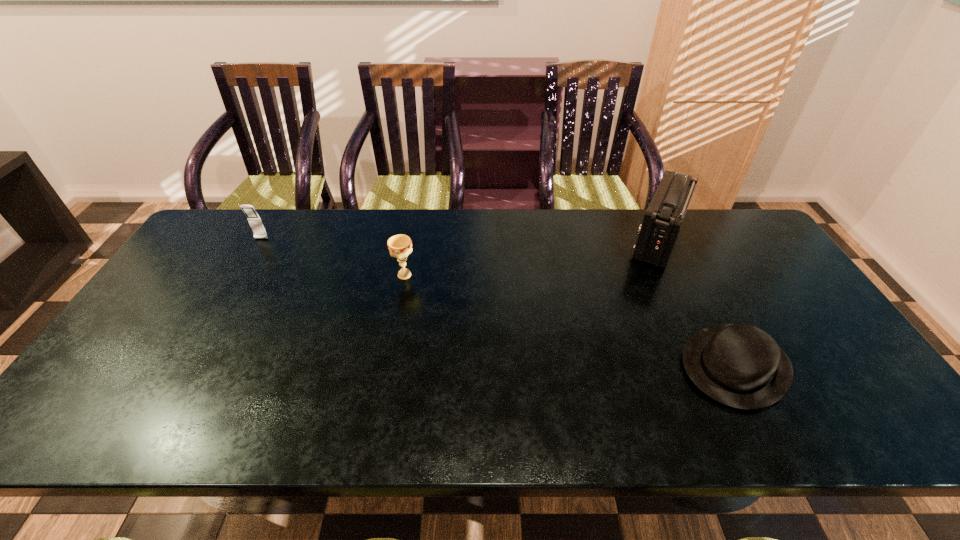
You are a GUI agent. You are given a task and a screenshot of the screen. Output one action in this format:
    pyautogui.click(x=<x>, y=<y>)
    Task: Click on the vacant space that's between the fedora and the leftmost object
    The image size is (960, 540).
    Given the screenshot: What is the action you would take?
    pyautogui.click(x=498, y=302)

Identify the location of object that stands as the third closest to the cellular telephone. (739, 365).

At what (x,y) coordinates should I click in order to perform the action: click on object that stands as the closest to the tallest object. Please return your answer as a coordinate pair (x, y). The image size is (960, 540). Looking at the image, I should click on click(739, 365).

Where is `free space that satisfies the following two spatial constraints: 1. on the front side of the nearest object; 2. on the left side of the chalice`? free space that satisfies the following two spatial constraints: 1. on the front side of the nearest object; 2. on the left side of the chalice is located at coordinates (388, 366).

Image resolution: width=960 pixels, height=540 pixels. Identify the location of vacant position in the image that satisfies the following two spatial constraints: 1. on the front panel of the fedora; 2. on the left side of the radio receiver. (717, 366).

At what (x,y) coordinates should I click in order to perform the action: click on free spot that satisfies the following two spatial constraints: 1. on the front panel of the tallest object; 2. on the front side of the third object from right to left. Please return your answer as a coordinate pair (x, y). Looking at the image, I should click on (674, 275).

Find the location of `vacant region that satisfies the following two spatial constraints: 1. on the front-facing side of the chalice; 2. on the left side of the leftmost object`. vacant region that satisfies the following two spatial constraints: 1. on the front-facing side of the chalice; 2. on the left side of the leftmost object is located at coordinates (240, 275).

The height and width of the screenshot is (540, 960). Identify the location of free space that satisfies the following two spatial constraints: 1. on the back side of the fedora; 2. on the front panel of the radio receiver. (671, 240).

This screenshot has height=540, width=960. I want to click on vacant space that satisfies the following two spatial constraints: 1. on the front side of the chalice; 2. on the right side of the nearest object, so click(x=388, y=366).